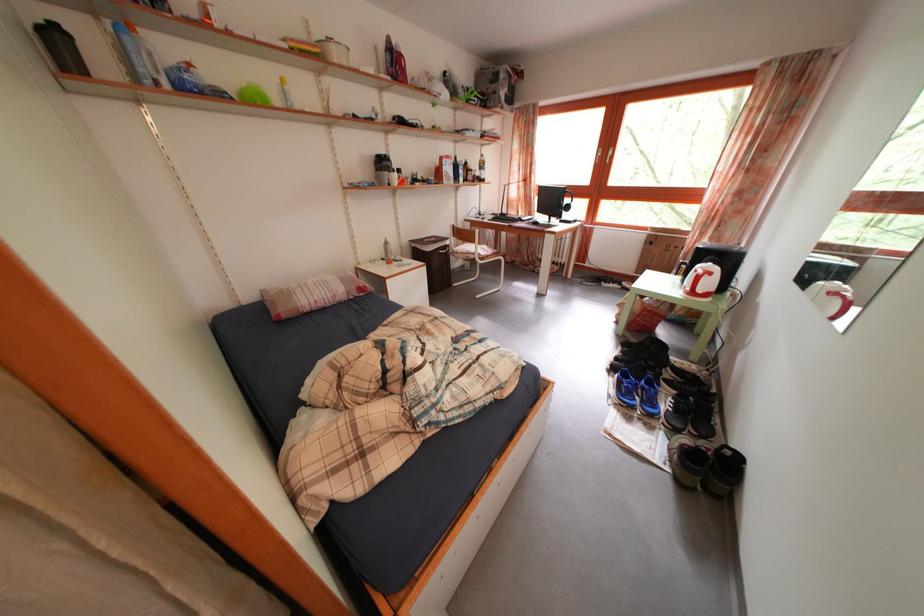
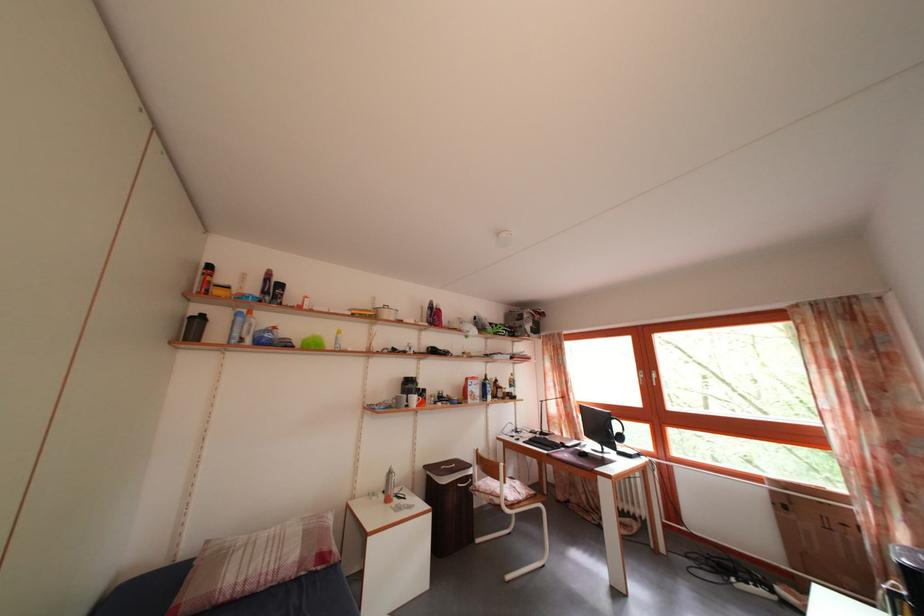
The point at (x=480, y=249) is marked in the first image. Where is the corresponding point in the second image?

(505, 485)